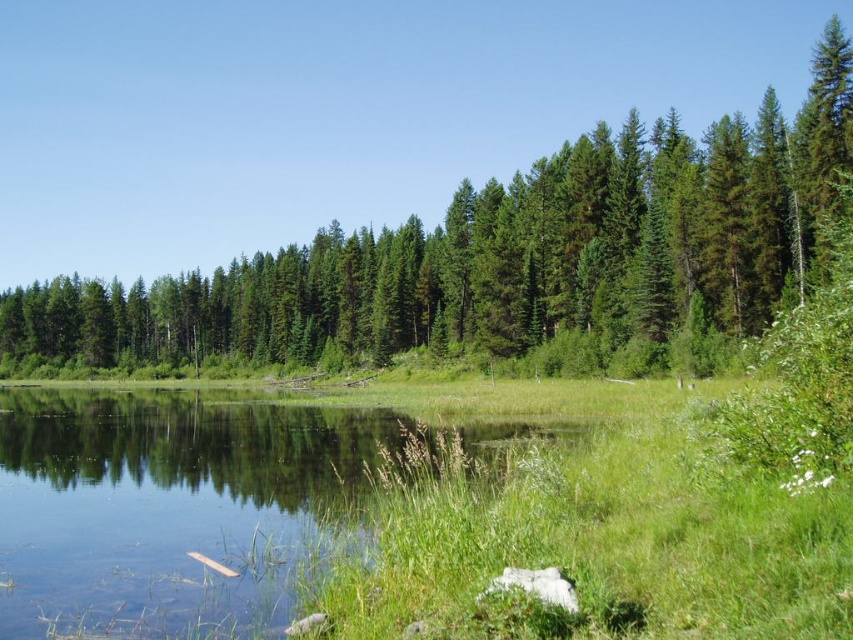
Between green matte trees at center and green grassy lake at center, which one appears on the left side from the viewer's perspective?

green matte trees at center is more to the left.

Is point (642, 266) farther from camera compared to point (80, 477)?

Yes.

Does point (572, 244) come farther from viewer compared to point (316, 488)?

Yes.

At what (x,y) coordinates should I click in order to perform the action: click on green matte trees at center. Please return your answer as a coordinate pair (x, y). Looking at the image, I should click on (502, 253).